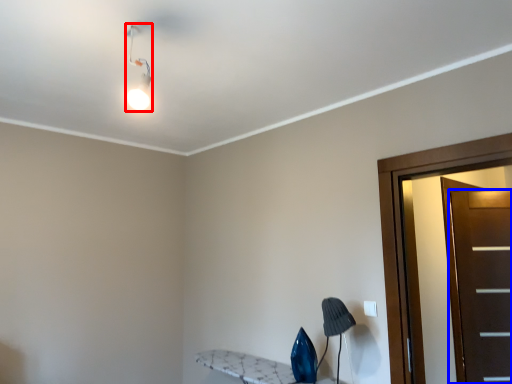
Question: Among these objects, which one is nearest to the camera, light fixture (highlighted by a red box) or door (highlighted by a blue box)?

Choices:
 (A) light fixture
 (B) door

Answer: (A)